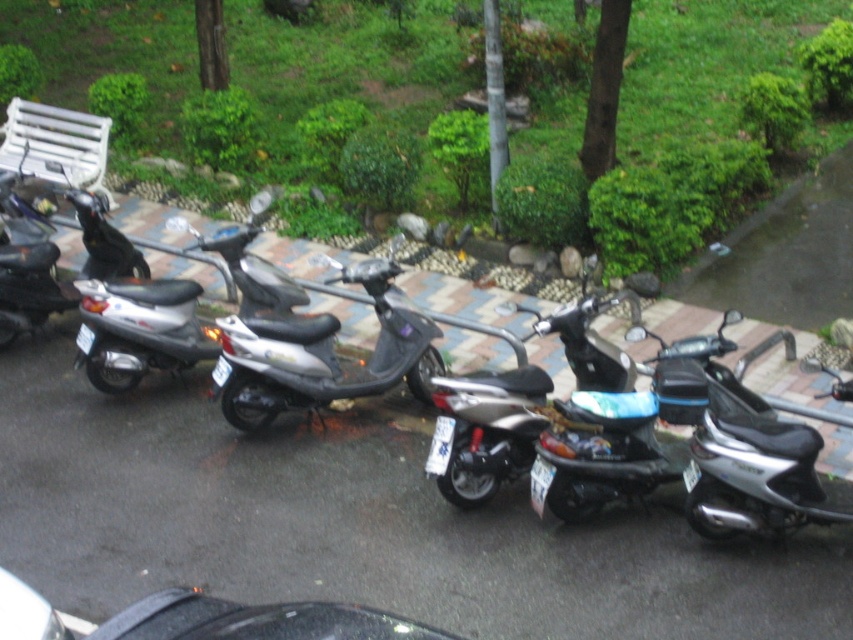
You are standing at the entrance of the building and want to find the matte black scooter at left. According to the coordinates provided, where should you look relative to the image center?

The matte black scooter at left is located at coordinates point (345,65), which places it to the lower left of the image center.

You need to choose between the matte black scooter at left and the silver metallic scooter at left to carry a large package. Which scooter should you choose based on their sizes?

The matte black scooter at left is larger in size than the silver metallic scooter at left, so you should choose the matte black scooter at left to carry the large package.